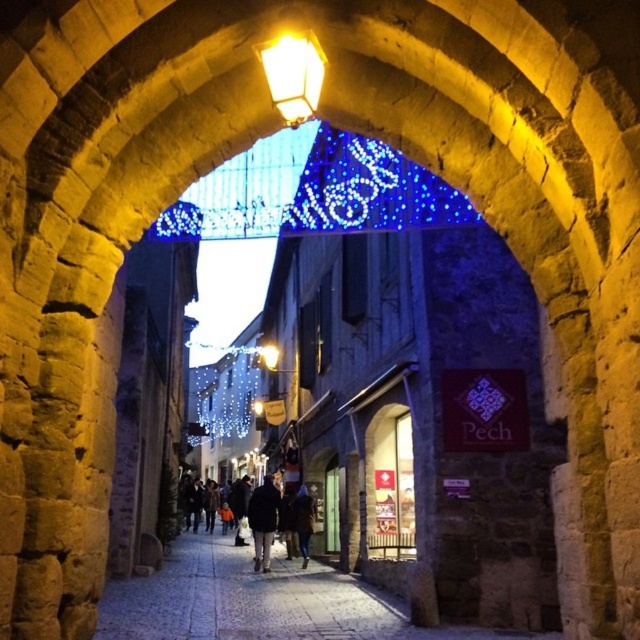
Question: Is dark gray coat at center further to the viewer compared to dark wool coat at center?

Choices:
 (A) no
 (B) yes

Answer: (B)

Question: Which of these objects is positioned farthest from the dark wool coat at center?

Choices:
 (A) illuminated string lights at center
 (B) matte yellow light at center
 (C) yellow glass streetlight at upper center

Answer: (A)

Question: Estimate the real-world distances between objects in this image. Which object is farther from the illuminated string lights at center?

Choices:
 (A) matte yellow light at center
 (B) dark wool coat at center

Answer: (B)

Question: Can you confirm if yellow glass streetlight at upper center is smaller than dark wool coat at center?

Choices:
 (A) no
 (B) yes

Answer: (B)

Question: Does dark gray coat at center appear under matte yellow light at center?

Choices:
 (A) yes
 (B) no

Answer: (A)

Question: Which object is closer to the camera taking this photo?

Choices:
 (A) matte yellow light at center
 (B) dark wool coat at center
 (C) dark gray coat at center

Answer: (B)